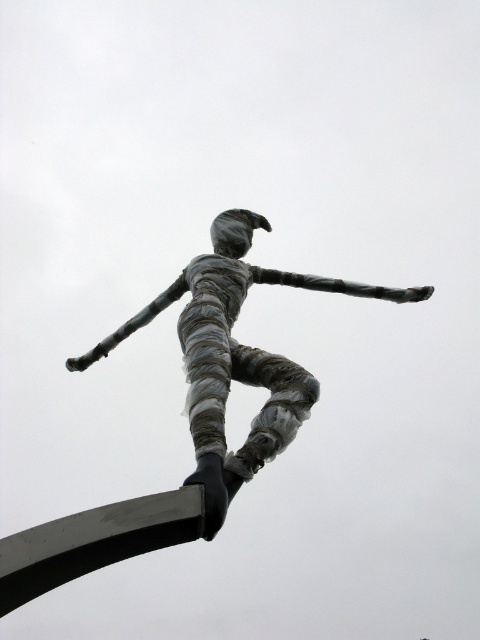
Question: Does shiny silver figure at center lie in front of black metal pole at lower left?

Choices:
 (A) yes
 (B) no

Answer: (B)

Question: Can you confirm if shiny silver figure at center is positioned to the right of black metal pole at lower left?

Choices:
 (A) no
 (B) yes

Answer: (B)

Question: Which object is farther from the camera taking this photo?

Choices:
 (A) black metal pole at lower left
 (B) shiny silver figure at center

Answer: (B)

Question: Considering the relative positions of shiny silver figure at center and black metal pole at lower left in the image provided, where is shiny silver figure at center located with respect to black metal pole at lower left?

Choices:
 (A) below
 (B) above

Answer: (B)